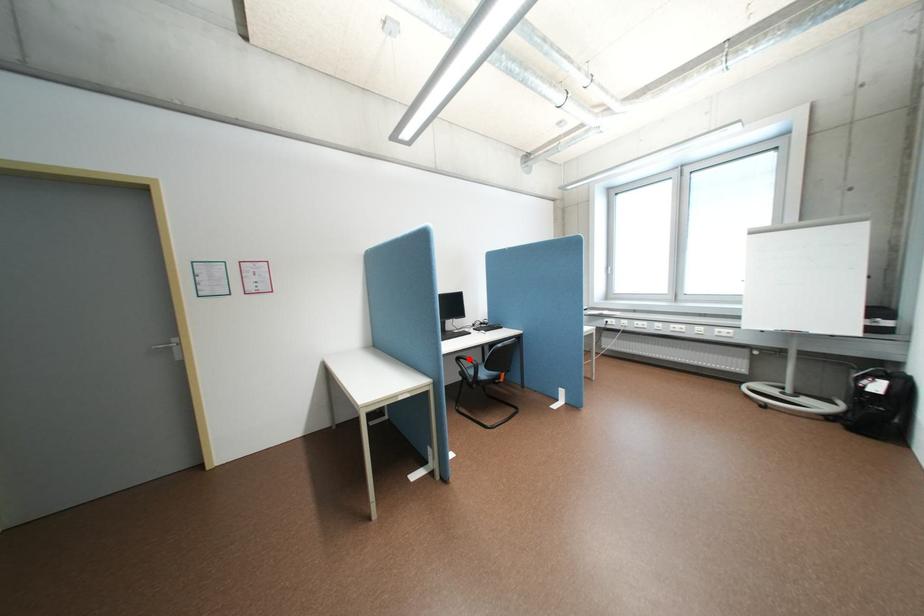
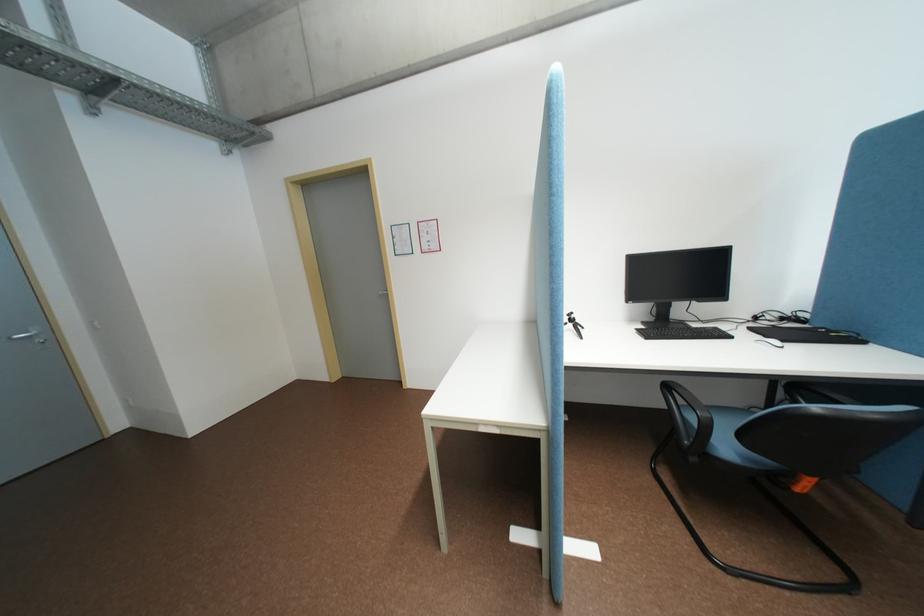
In the second image, find the point that corresponds to the highlighted location in the first image.

(677, 386)